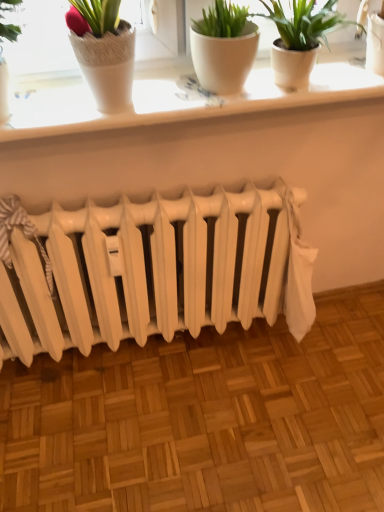
In order to click on free spot in front of white matte radiator at center in this screenshot , I will do `click(160, 431)`.